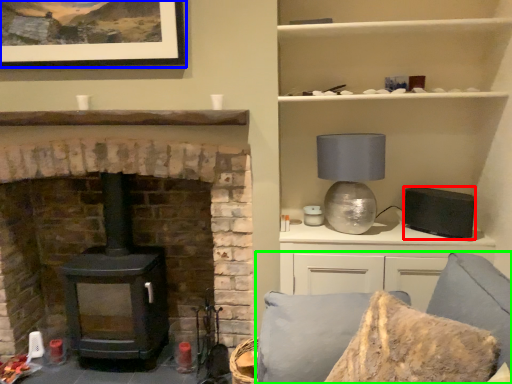
Question: Which is nearer to the appliance (highlighted by a red box)? picture frame (highlighted by a blue box) or couch (highlighted by a green box).

Choices:
 (A) picture frame
 (B) couch

Answer: (B)